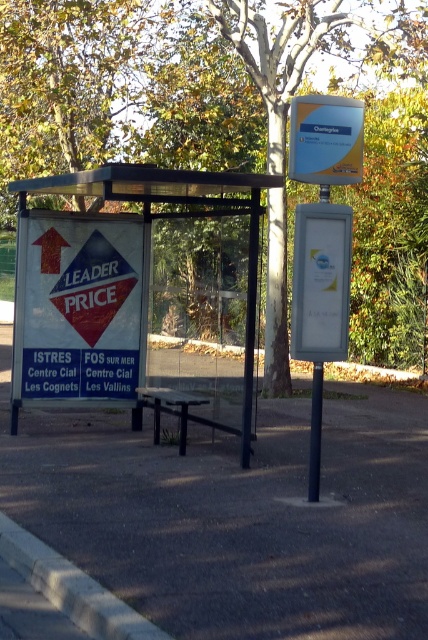
You are standing at the bus stop shelter and want to know which point is closer to you. The points are point 1 at coordinates (291, 340) and point 2 at coordinates (309, 170). Which point is closer to you?

Point 2 at coordinates (309, 170) is closer to you because it is less further to the viewer than point 1 at coordinates (291, 340).

Based on the photo, you are a person waiting at the bus stop and need to read the schedule. The white plastic sign at upper right has the schedule. Can you easily see the schedule from where you are sitting on the white plastic bus stop at center?

The white plastic bus stop at center has a larger size compared to white plastic sign at upper right. Since the sign is smaller, it might be harder to read from a distance, but since it is placed at upper right, you might need to look up. However, the exact visibility depends on the sign font size and your eyesight.

You are a bus driver who needs to park your vehicle precisely so that it aligns with the white plastic bus stop at center. Given that the white plastic sign at upper right is located above the bus stop, will the sign be visible from the driver seat once parked?

The white plastic sign at upper right is narrower than the white plastic bus stop at center since the bus stop is wider. Therefore, the sign will be visible from the driver seat once parked because its narrower width allows it to be positioned above without being fully obscured by the wider bus stop.